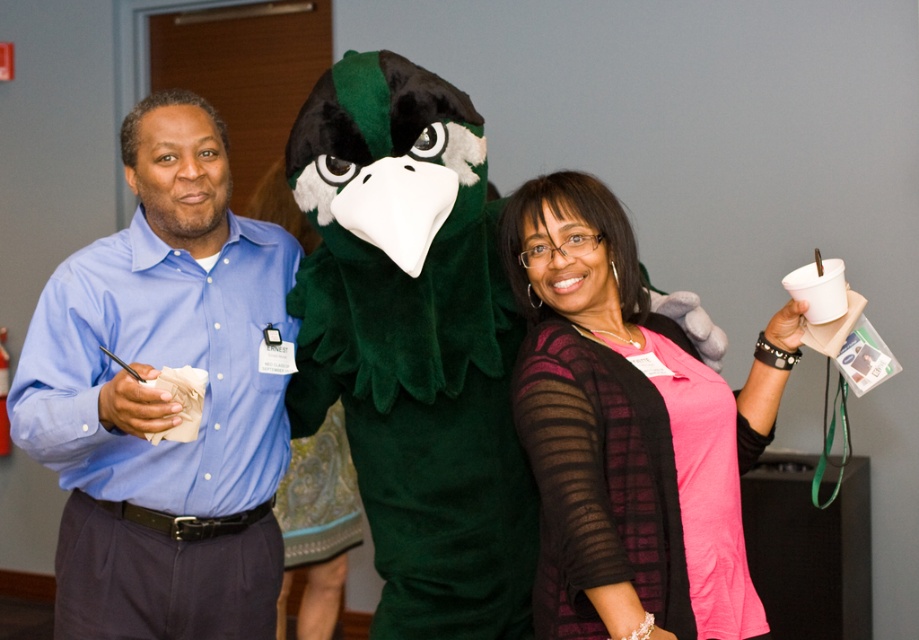
You are standing in front of the green fuzzy mascot at center and the pink matte shirt at center. Which one is closer to you?

The green fuzzy mascot at center is closer to you than the pink matte shirt at center.

Looking at the green fuzzy mascot at center and the pink matte shirt at center, which one is positioned more to the left side?

The green fuzzy mascot at center is positioned more to the left side of the pink matte shirt at center.